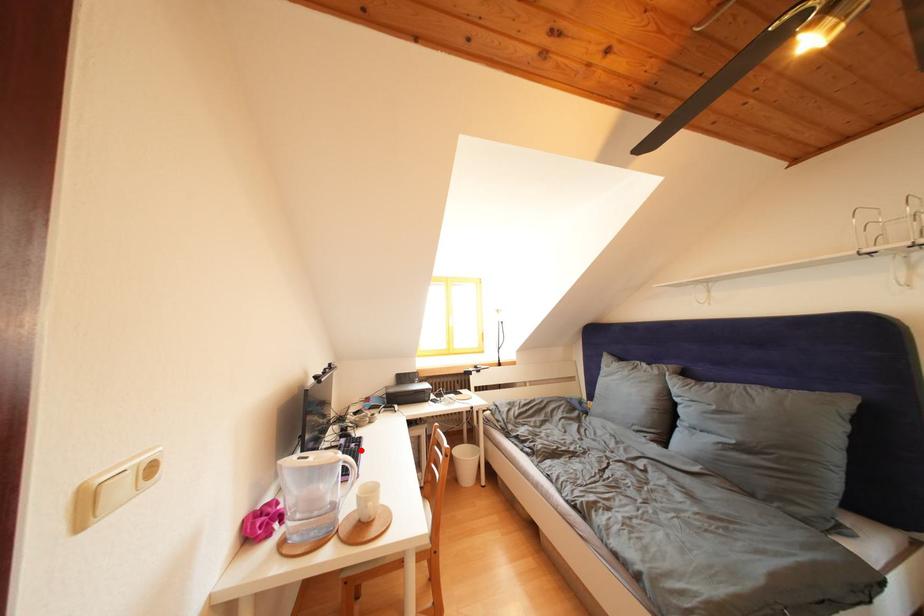
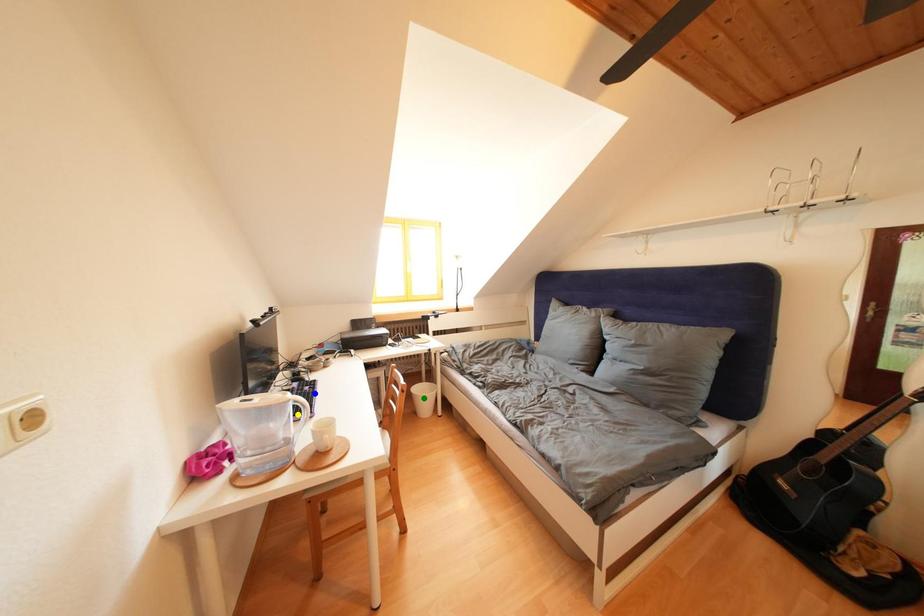
Question: I am providing you with two images of the same scene from different viewpoints. A red point is marked on the first image. You are given multiple points on the second image. Which spot in image 2 lines up with the point in image 1?

Choices:
 (A) yellow point
 (B) green point
 (C) blue point

Answer: (C)